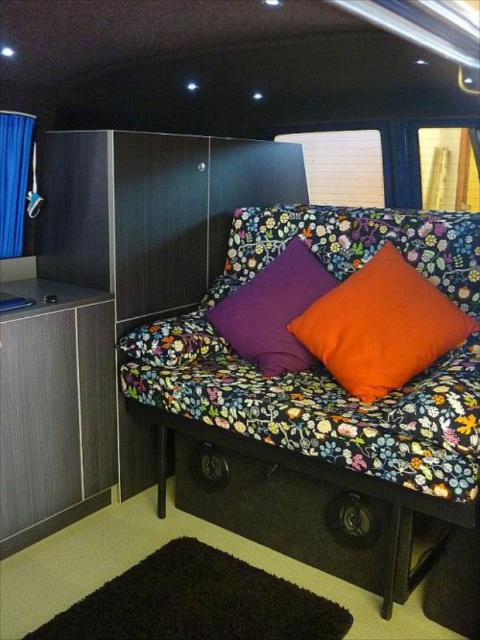
Question: Does orange fabric pillow at center appear over purple fabric pillow at center?

Choices:
 (A) yes
 (B) no

Answer: (B)

Question: Does purple fabric pillow at center have a lesser width compared to blue fabric curtain at left?

Choices:
 (A) yes
 (B) no

Answer: (B)

Question: Which point is farther to the camera?

Choices:
 (A) (355, 387)
 (B) (309, 509)

Answer: (B)

Question: Which of the following is the farthest from the observer?

Choices:
 (A) orange fabric pillow at center
 (B) purple fabric pillow at center
 (C) blue fabric curtain at left

Answer: (C)

Question: Does floral fabric couch at center appear on the left side of blue fabric curtain at left?

Choices:
 (A) no
 (B) yes

Answer: (A)

Question: Which object is the closest to the purple fabric pillow at center?

Choices:
 (A) floral fabric couch at center
 (B) blue fabric curtain at left

Answer: (A)